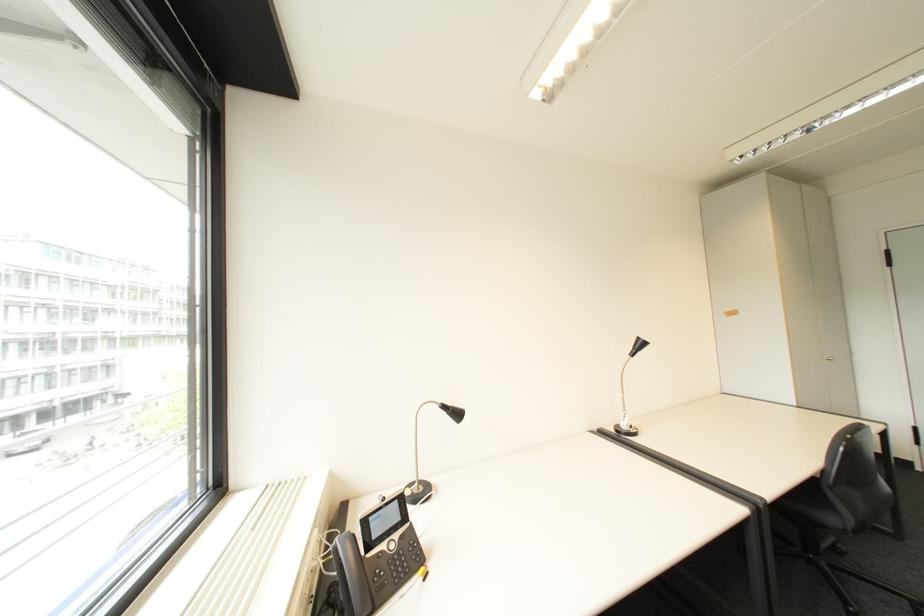
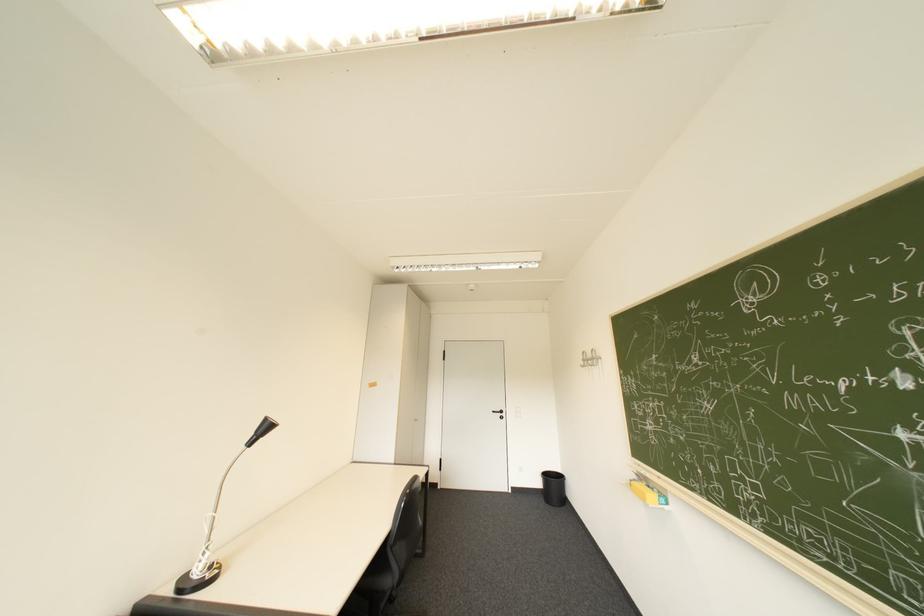
Where in the second image is the point corresponding to (643,347) from the first image?

(266, 434)